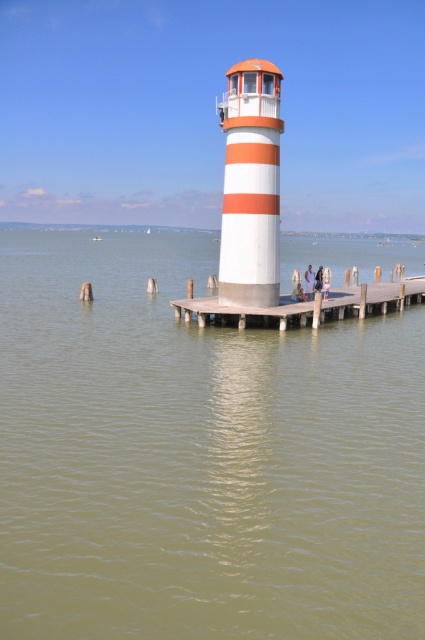
You are standing at point (x=308, y=307) on the wooden pier. What object is located exactly at your current position?

The wooden dock at center is located exactly at point (x=308, y=307).

You are standing at the point with coordinates (308, 307). What object are you standing on?

You are standing on the wooden dock at center located at point (308, 307).

You are standing at the base of the lighthouse on the wooden pier. You see a point marked at coordinates (308, 282). What object is located at that point?

The point at coordinates (308, 282) marks the location of the white fabric person at center.